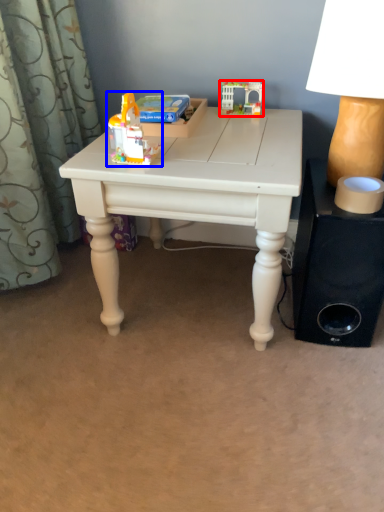
Question: Which object appears closest to the camera in this image, toy (highlighted by a red box) or toy (highlighted by a blue box)?

Choices:
 (A) toy
 (B) toy

Answer: (B)